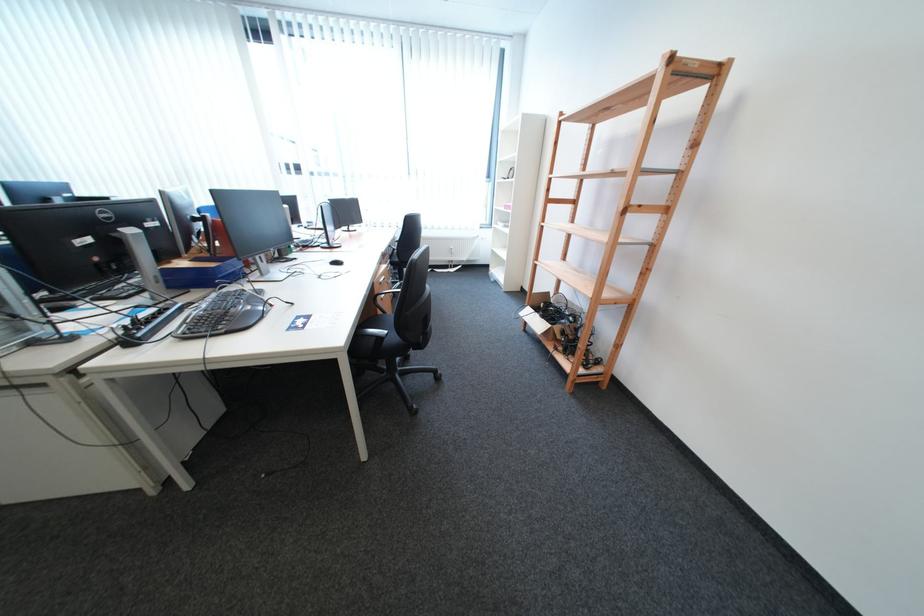
Identify the location of chair armrest. This screenshot has width=924, height=616. (371, 333).